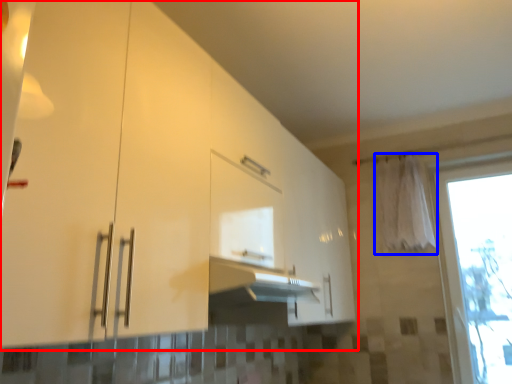
Question: Which object is further to the camera taking this photo, cabinetry (highlighted by a red box) or curtain (highlighted by a blue box)?

Choices:
 (A) cabinetry
 (B) curtain

Answer: (B)